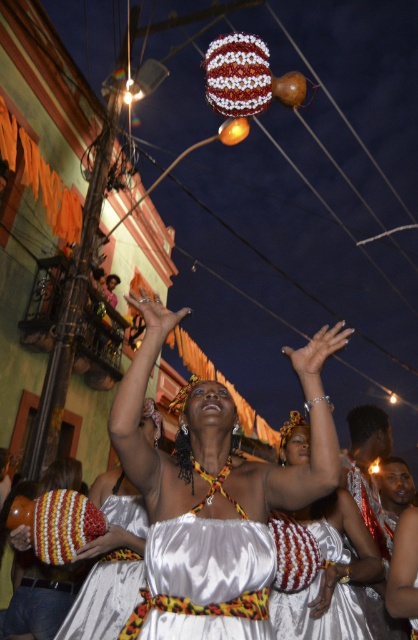
Consider the image. Is satin white dress at center shorter than knitted fabric dress at center?

No.

Find the location of a particular element. satin white dress at center is located at coordinates (214, 496).

The width and height of the screenshot is (418, 640). What are the coordinates of `satin white dress at center` in the screenshot? It's located at (214, 496).

Is satin white dress at center thinner than white satin dress at center?

No, satin white dress at center is not thinner than white satin dress at center.

Can you confirm if satin white dress at center is taller than white satin dress at center?

Indeed, satin white dress at center has a greater height compared to white satin dress at center.

Which is in front, point (231, 547) or point (349, 598)?

Point (231, 547)

Where is `satin white dress at center`? satin white dress at center is located at coordinates 214,496.

Is white satin dress at center to the left of knitted fabric dress at center from the viewer's perspective?

In fact, white satin dress at center is to the right of knitted fabric dress at center.

Is white satin dress at center wider than knitted fabric dress at center?

Yes, white satin dress at center is wider than knitted fabric dress at center.

The height and width of the screenshot is (640, 418). Describe the element at coordinates (311, 582) in the screenshot. I see `white satin dress at center` at that location.

The height and width of the screenshot is (640, 418). What are the coordinates of `white satin dress at center` in the screenshot? It's located at (311, 582).